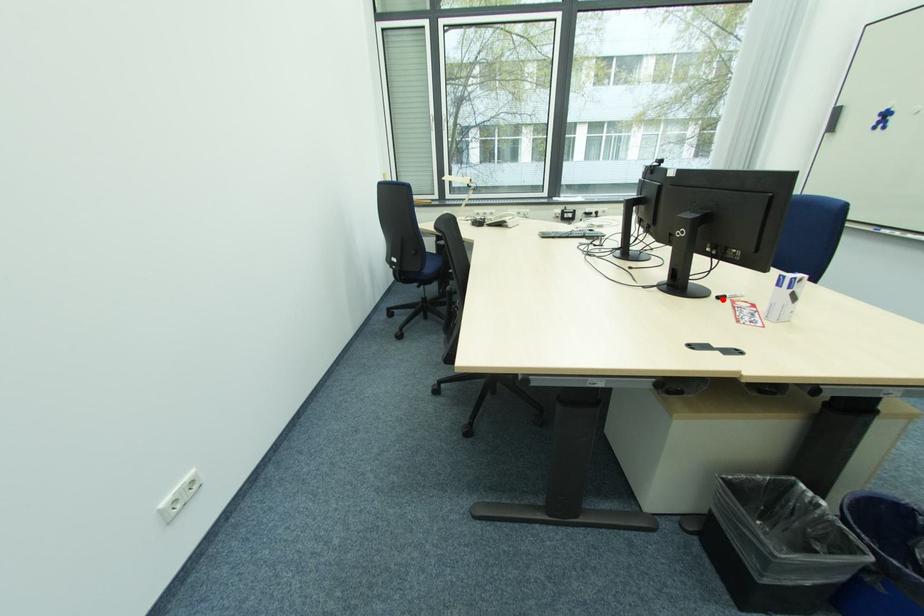
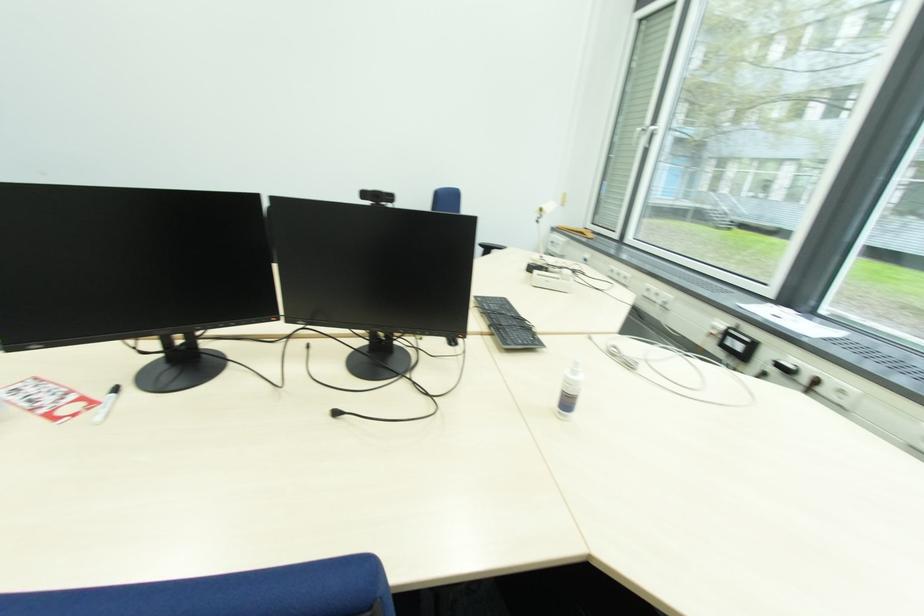
Locate, in the second image, the point that corresponds to the highlighted location in the first image.

(118, 392)